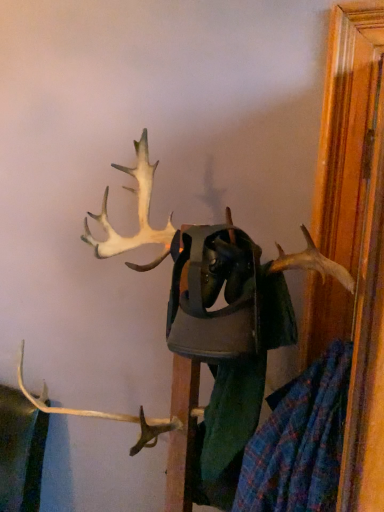
Question: From their relative heights in the image, would you say white matte antlers at upper center is taller or shorter than plaid fabric shirt at center?

Choices:
 (A) tall
 (B) short

Answer: (A)

Question: Visually, is white matte antlers at upper center positioned to the left or to the right of plaid fabric shirt at center?

Choices:
 (A) left
 (B) right

Answer: (A)

Question: Is point (288, 338) positioned closer to the camera than point (248, 370)?

Choices:
 (A) closer
 (B) farther

Answer: (A)

Question: Would you say plaid fabric shirt at center is to the left or to the right of white matte antlers at upper center in the picture?

Choices:
 (A) left
 (B) right

Answer: (B)

Question: Is plaid fabric shirt at center bigger or smaller than white matte antlers at upper center?

Choices:
 (A) small
 (B) big

Answer: (A)

Question: In terms of height, does plaid fabric shirt at center look taller or shorter compared to white matte antlers at upper center?

Choices:
 (A) short
 (B) tall

Answer: (A)

Question: Does point (210, 330) appear closer or farther from the camera than point (215, 485)?

Choices:
 (A) closer
 (B) farther

Answer: (A)